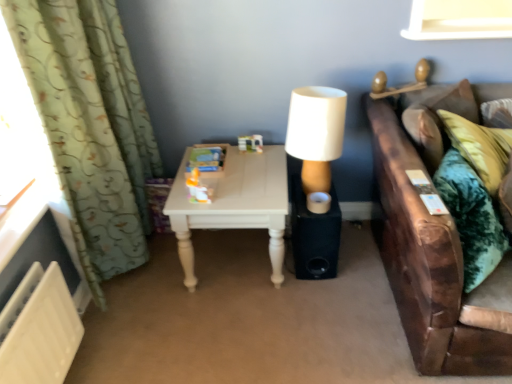
Image resolution: width=512 pixels, height=384 pixels. Identify the location of white painted wood table at center. (234, 204).

Identify the location of black matte speaker at lower right. (314, 235).

From the picture: Measure the distance between translucent plastic toy at center and camera.

The depth of translucent plastic toy at center is 1.73 meters.

What do you see at coordinates (198, 189) in the screenshot? This screenshot has height=384, width=512. I see `translucent plastic toy at center` at bounding box center [198, 189].

What do you see at coordinates (91, 126) in the screenshot? The height and width of the screenshot is (384, 512). I see `green textured curtain at left` at bounding box center [91, 126].

Where is `white painted wood table at center`? white painted wood table at center is located at coordinates (234, 204).

The image size is (512, 384). I want to click on speaker on the right side of white matte lampshade at center, so click(x=314, y=235).

Is black matte speaker at lower right positioned before white matte lampshade at center?

No, black matte speaker at lower right is further to the viewer.

Could you tell me if black matte speaker at lower right is turned towards white matte lampshade at center?

No.

Is black matte speaker at lower right with white matte lampshade at center?

No.

Is black matte speaker at lower right closer to camera compared to translucent plastic toy at center?

No, the depth of black matte speaker at lower right is greater than that of translucent plastic toy at center.

Is black matte speaker at lower right aimed at translucent plastic toy at center?

No, black matte speaker at lower right is not oriented towards translucent plastic toy at center.

Considering the relative positions of black matte speaker at lower right and translucent plastic toy at center in the image provided, is black matte speaker at lower right to the left of translucent plastic toy at center from the viewer's perspective?

No, black matte speaker at lower right is not to the left of translucent plastic toy at center.

Which is closer to the camera, [329,266] or [200,189]?

Point [329,266] appears to be farther away from the viewer than point [200,189].

Considering the relative positions of white painted wood table at center and green textured curtain at left in the image provided, is white painted wood table at center to the right of green textured curtain at left from the viewer's perspective?

Yes, white painted wood table at center is to the right of green textured curtain at left.

What's the angular difference between white painted wood table at center and green textured curtain at left's facing directions?

The angle between the facing direction of white painted wood table at center and the facing direction of green textured curtain at left is 89.1 degrees.

Does point (277, 155) come in front of point (47, 70)?

No, it is behind (47, 70).

Is white painted wood table at center in front of or behind green textured curtain at left in the image?

white painted wood table at center is behind green textured curtain at left.

Considering the sizes of white painted wood table at center and white matte lampshade at center in the image, is white painted wood table at center bigger or smaller than white matte lampshade at center?

Clearly, white painted wood table at center is larger in size than white matte lampshade at center.

Would you say white painted wood table at center is to the left or to the right of white matte lampshade at center in the picture?

Clearly, white painted wood table at center is on the left of white matte lampshade at center in the image.

How different are the orientations of white painted wood table at center and white matte lampshade at center in degrees?

The facing directions of white painted wood table at center and white matte lampshade at center are 3.49 degrees apart.

Which is closer, [234,192] or [329,136]?

Point [234,192] is farther from the camera than point [329,136].

Is green textured curtain at left to the right of black matte speaker at lower right from the viewer's perspective?

No.

Is green textured curtain at left further to the viewer compared to black matte speaker at lower right?

No.

Is green textured curtain at left wider or thinner than black matte speaker at lower right?

Considering their sizes, green textured curtain at left looks slimmer than black matte speaker at lower right.

Is green textured curtain at left placed right next to black matte speaker at lower right?

No, green textured curtain at left is not beside black matte speaker at lower right.

Which is behind, point (194, 189) or point (234, 208)?

Point (194, 189)

How different are the orientations of translucent plastic toy at center and white painted wood table at center in degrees?

The angular difference between translucent plastic toy at center and white painted wood table at center is 2.17 degrees.

Which object is positioned more to the right, translucent plastic toy at center or white painted wood table at center?

white painted wood table at center.

From a real-world perspective, between translucent plastic toy at center and white painted wood table at center, who is vertically lower?

white painted wood table at center is physically lower.

Who is more distant, white painted wood table at center or black matte speaker at lower right?

black matte speaker at lower right.

Is white painted wood table at center not close to black matte speaker at lower right?

No, white painted wood table at center is not far from black matte speaker at lower right.

Would you say white painted wood table at center is inside or outside black matte speaker at lower right?

white painted wood table at center is spatially situated outside black matte speaker at lower right.

From the image's perspective, which one is positioned higher, white painted wood table at center or black matte speaker at lower right?

white painted wood table at center appears higher in the image.

Identify the location of table lamp that appears above the black matte speaker at lower right (from the image's perspective). The image size is (512, 384). pos(316,133).

You are a GUI agent. You are given a task and a screenshot of the screen. Output one action in this format:
    pyautogui.click(x=<x>, y=<y>)
    Task: Click on the speaker that is on the right side of translucent plastic toy at center
    
    Given the screenshot: What is the action you would take?
    pyautogui.click(x=314, y=235)

When comparing their distances from black matte speaker at lower right, does green textured curtain at left or white painted wood table at center seem closer?

white painted wood table at center is positioned closer to the anchor black matte speaker at lower right.

Which object lies nearer to the anchor point translucent plastic toy at center, white matte lampshade at center or green textured curtain at left?

Based on the image, white matte lampshade at center appears to be nearer to translucent plastic toy at center.

Estimate the real-world distances between objects in this image. Which object is further from green textured curtain at left, black matte speaker at lower right or white matte lampshade at center?

black matte speaker at lower right.

When comparing their distances from green textured curtain at left, does white painted wood table at center or black matte speaker at lower right seem further?

black matte speaker at lower right is further to green textured curtain at left.

Looking at the image, which one is located closer to velvet green couch at right, white painted wood table at center or green textured curtain at left?

white painted wood table at center.

Looking at the image, which one is located closer to black matte speaker at lower right, translucent plastic toy at center or white matte lampshade at center?

white matte lampshade at center.

Considering their positions, is white matte lampshade at center positioned further to black matte speaker at lower right than white painted wood table at center?

Among the two, white matte lampshade at center is located further to black matte speaker at lower right.

Looking at the image, which one is located closer to velvet green couch at right, white matte lampshade at center or green textured curtain at left?

The object closer to velvet green couch at right is white matte lampshade at center.

Find the location of a particular element. table lamp between velvet green couch at right and black matte speaker at lower right along the z-axis is located at coordinates (316, 133).

Where is `table lamp situated between green textured curtain at left and black matte speaker at lower right from left to right`? table lamp situated between green textured curtain at left and black matte speaker at lower right from left to right is located at coordinates (316, 133).

The width and height of the screenshot is (512, 384). I want to click on table lamp located between green textured curtain at left and velvet green couch at right in the left-right direction, so click(x=316, y=133).

The image size is (512, 384). What are the coordinates of `table lamp between translucent plastic toy at center and black matte speaker at lower right from left to right` in the screenshot? It's located at [316, 133].